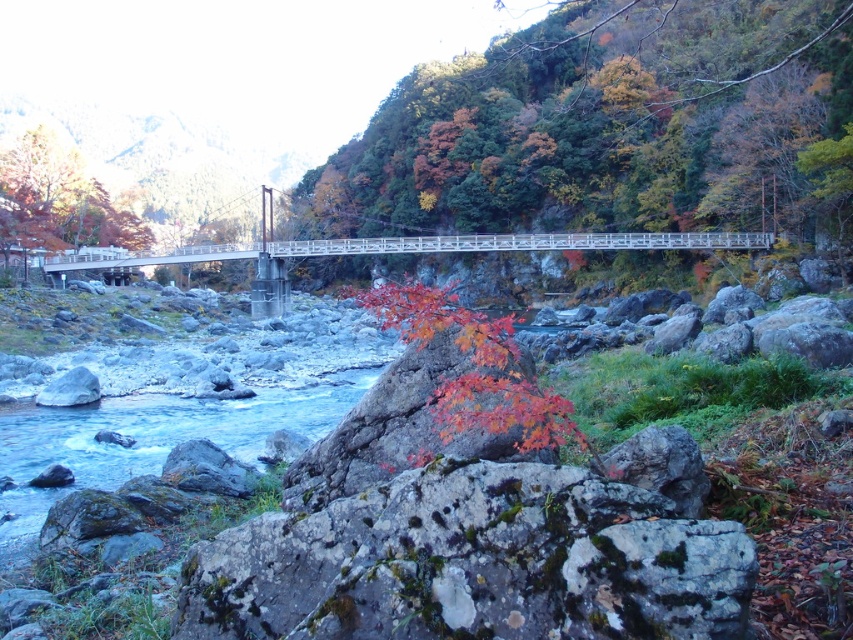
Question: Which object is closer to the camera taking this photo?

Choices:
 (A) mossy gray rock at center
 (B) smooth gray rock at lower left
 (C) autumn leaves at upper left
 (D) white wooden bridge at center

Answer: (A)

Question: Does mossy gray rock at center have a greater width compared to white wooden bridge at center?

Choices:
 (A) yes
 (B) no

Answer: (B)

Question: Estimate the real-world distances between objects in this image. Which object is farther from the smooth gray rock at lower left?

Choices:
 (A) white wooden bridge at center
 (B) autumn leaves at upper left
 (C) mossy gray rock at center

Answer: (B)

Question: From the image, what is the correct spatial relationship of autumn leaves at upper left in relation to smooth gray rock at lower left?

Choices:
 (A) right
 (B) left

Answer: (B)

Question: Does mossy gray rock at center appear over white wooden bridge at center?

Choices:
 (A) no
 (B) yes

Answer: (A)

Question: Which is farther from the smooth gray rock at lower left?

Choices:
 (A) autumn leaves at upper left
 (B) white wooden bridge at center

Answer: (A)